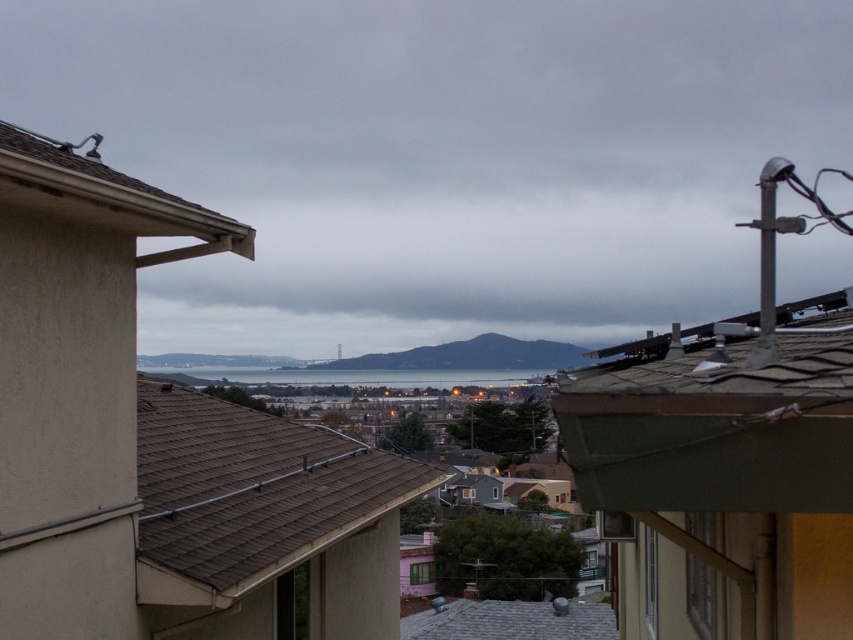
You are standing on the rooftop and looking at the brown shingles at center and the brown shingles at upper left. Which one is positioned lower in your field of view?

The brown shingles at center is positioned lower than the brown shingles at upper left, so it is lower in your field of view.

You are standing on the rooftop and want to take a photo of both the point at coordinates point (231, 490) and point (129, 200). Which point should you focus on first to ensure both are in focus?

You should focus on point (129, 200) first because it is closer to the camera than point (231, 490). By focusing on the closer point, the further point will also be in focus due to the depth of field.

You are standing on the rooftop and looking out. You see the green shingles at upper right and the gray shingles at center. Which of these two objects is positioned higher in the visual field?

The green shingles at upper right is positioned higher in the visual field than the gray shingles at center because it is described as being above it.